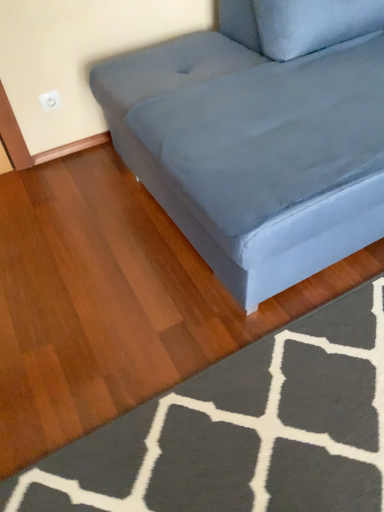
Where is `free space behind dark gray textured rug at lower right`? This screenshot has height=512, width=384. free space behind dark gray textured rug at lower right is located at coordinates (175, 292).